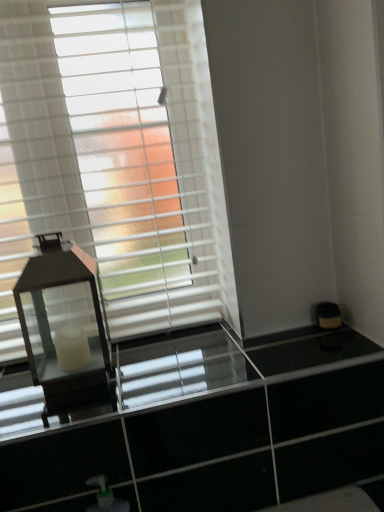
The width and height of the screenshot is (384, 512). In order to click on free space in front of matte black lantern at left in this screenshot , I will do `click(64, 410)`.